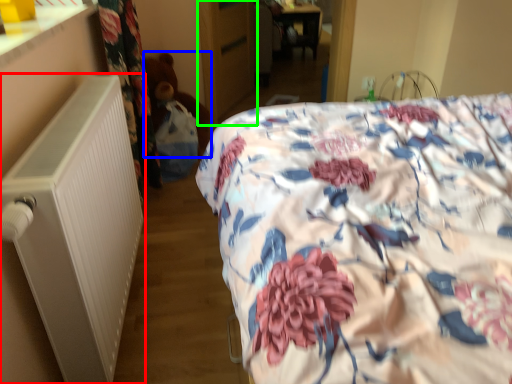
Question: Which object is positioned farthest from radiator (highlighted by a red box)? Select from teddy (highlighted by a blue box) and armoire (highlighted by a green box).

Choices:
 (A) teddy
 (B) armoire

Answer: (B)